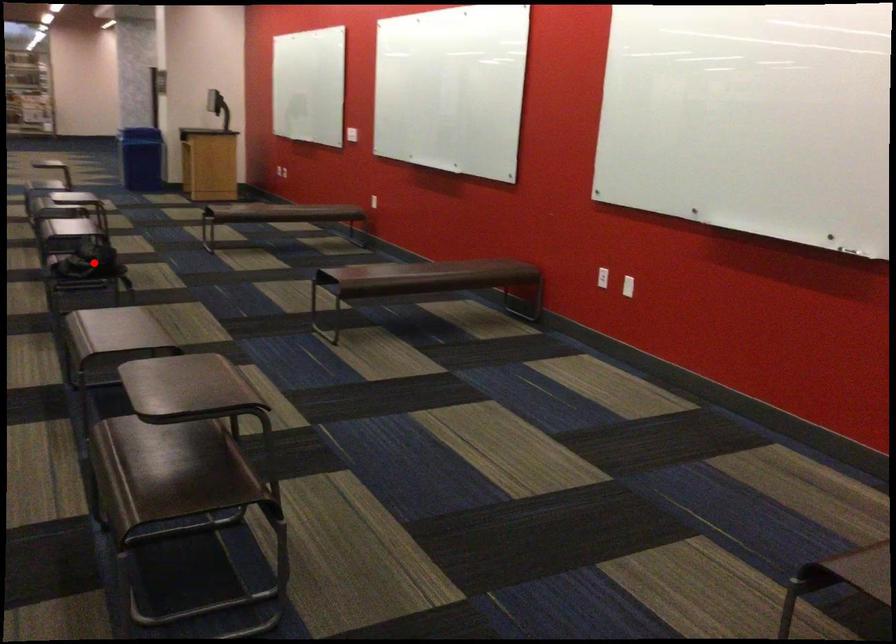
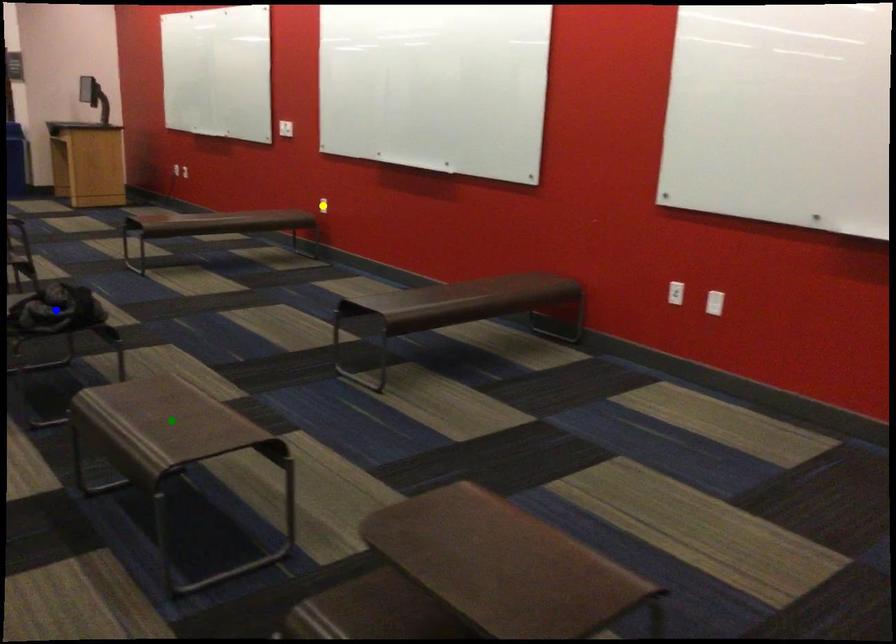
Question: I am providing you with two images of the same scene from different viewpoints. A red point is marked on the first image. You are given multiple points on the second image. Can you choose the point in image 2 that corresponds to the point in image 1?

Choices:
 (A) green point
 (B) yellow point
 (C) blue point

Answer: (C)